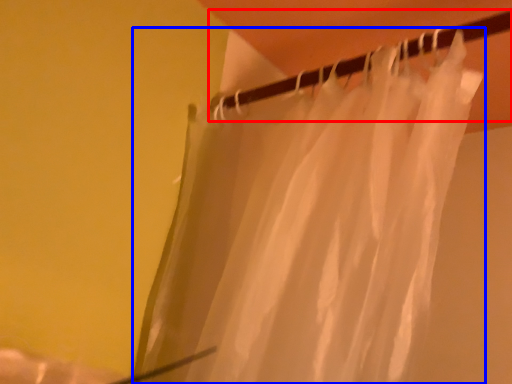
Question: Among these objects, which one is nearest to the camera, clothesline (highlighted by a red box) or curtain (highlighted by a blue box)?

Choices:
 (A) clothesline
 (B) curtain

Answer: (B)